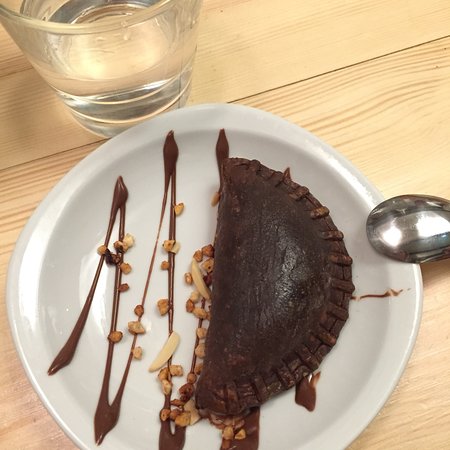
The height and width of the screenshot is (450, 450). I want to click on spoon, so click(x=403, y=243).